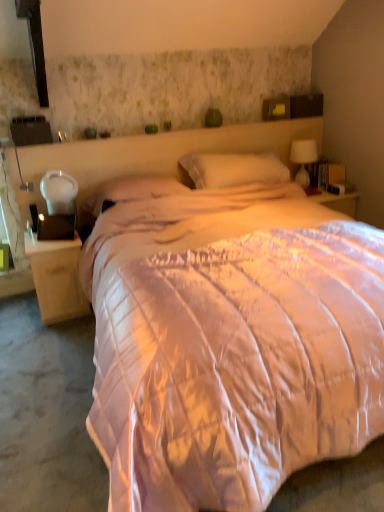
Question: Is white glass table lamp at upper right thinner than white soft pillow at center, which appears as the first pillow when viewed from the right?

Choices:
 (A) yes
 (B) no

Answer: (A)

Question: Is white glass table lamp at upper right touching white soft pillow at center, placed as the 2th pillow when sorted from left to right?

Choices:
 (A) no
 (B) yes

Answer: (A)

Question: Can you confirm if white glass table lamp at upper right is shorter than white soft pillow at center, which appears as the first pillow when viewed from the right?

Choices:
 (A) yes
 (B) no

Answer: (B)

Question: Considering the relative sizes of white glass table lamp at upper right and white soft pillow at center, which appears as the first pillow when viewed from the right, in the image provided, is white glass table lamp at upper right taller than white soft pillow at center, which appears as the first pillow when viewed from the right,?

Choices:
 (A) yes
 (B) no

Answer: (A)

Question: Is white glass table lamp at upper right wider than white soft pillow at center, placed as the 2th pillow when sorted from left to right?

Choices:
 (A) no
 (B) yes

Answer: (A)

Question: Is white soft pillow at center, placed as the 2th pillow when sorted from left to right, to the left or to the right of matte pink pillow at center, which is the 2th pillow in right-to-left order, in the image?

Choices:
 (A) right
 (B) left

Answer: (A)

Question: In terms of width, does white soft pillow at center, which appears as the first pillow when viewed from the right, look wider or thinner when compared to matte pink pillow at center, which is the first pillow from left to right?

Choices:
 (A) wide
 (B) thin

Answer: (A)

Question: In terms of height, does white soft pillow at center, placed as the 2th pillow when sorted from left to right, look taller or shorter compared to matte pink pillow at center, which is the 2th pillow in right-to-left order?

Choices:
 (A) tall
 (B) short

Answer: (A)

Question: Considering their positions, is white soft pillow at center, which appears as the first pillow when viewed from the right, located in front of or behind matte pink pillow at center, which is the 2th pillow in right-to-left order?

Choices:
 (A) behind
 (B) front

Answer: (A)

Question: From a real-world perspective, is matte pink pillow at center, which is the first pillow from left to right, above or below white matte nightstand at left?

Choices:
 (A) below
 (B) above

Answer: (B)

Question: Is matte pink pillow at center, which is the first pillow from left to right, to the left or to the right of white matte nightstand at left in the image?

Choices:
 (A) right
 (B) left

Answer: (A)

Question: Looking at their shapes, would you say matte pink pillow at center, which is the 2th pillow in right-to-left order, is wider or thinner than white matte nightstand at left?

Choices:
 (A) thin
 (B) wide

Answer: (A)

Question: Does point (160, 193) appear closer or farther from the camera than point (31, 244)?

Choices:
 (A) farther
 (B) closer

Answer: (B)

Question: Is point (248, 169) closer or farther from the camera than point (77, 254)?

Choices:
 (A) farther
 (B) closer

Answer: (A)

Question: In terms of width, does white soft pillow at center, which appears as the first pillow when viewed from the right, look wider or thinner when compared to white matte nightstand at left?

Choices:
 (A) thin
 (B) wide

Answer: (A)